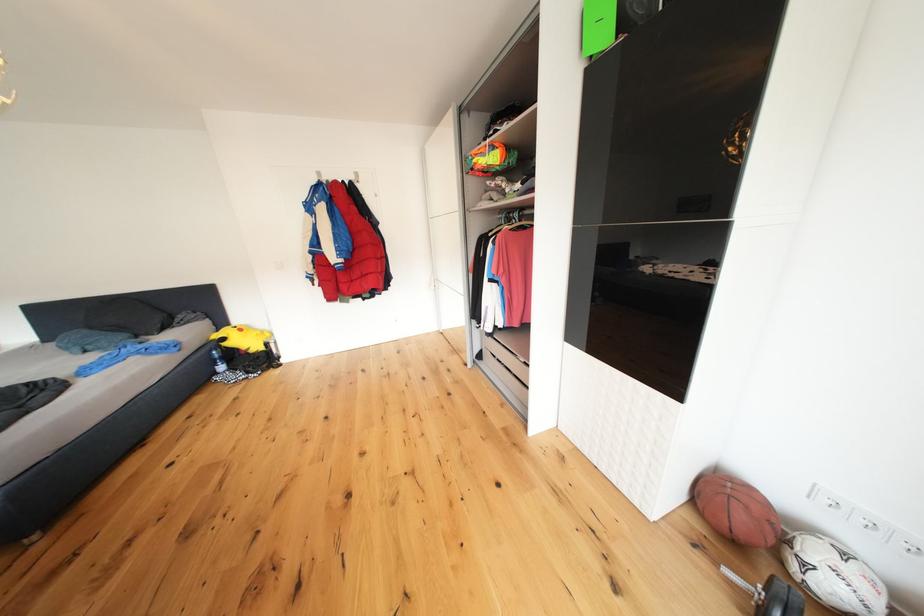
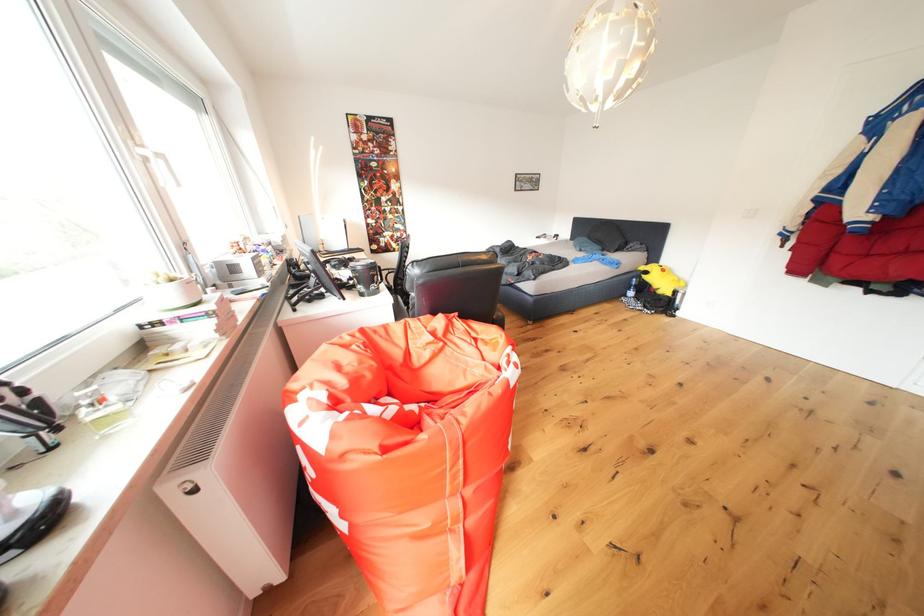
The point at (208, 360) is marked in the first image. Where is the corresponding point in the second image?

(634, 282)